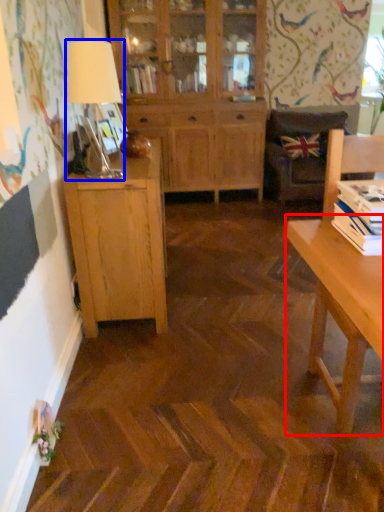
Question: Which point is further to the camera, desk (highlighted by a red box) or table lamp (highlighted by a blue box)?

Choices:
 (A) desk
 (B) table lamp

Answer: (B)